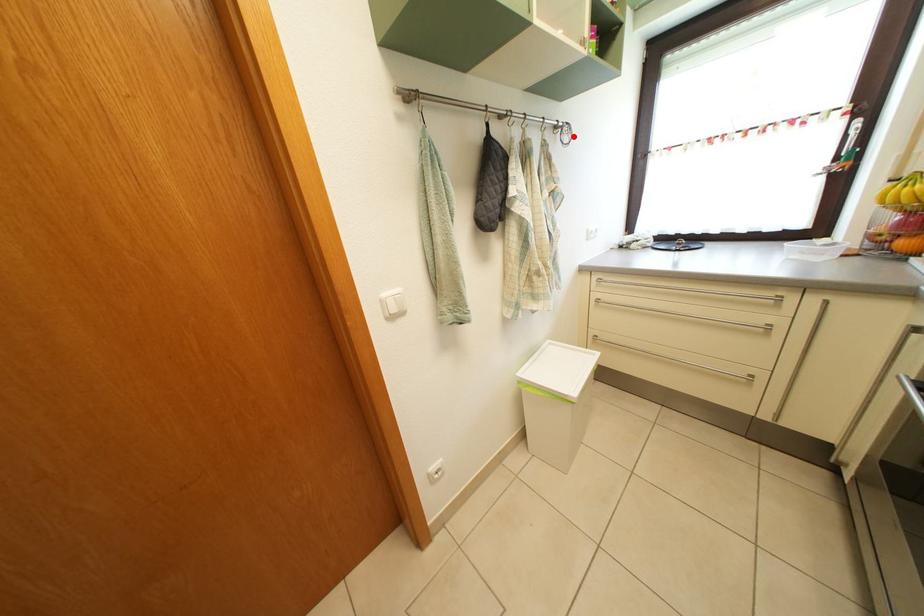
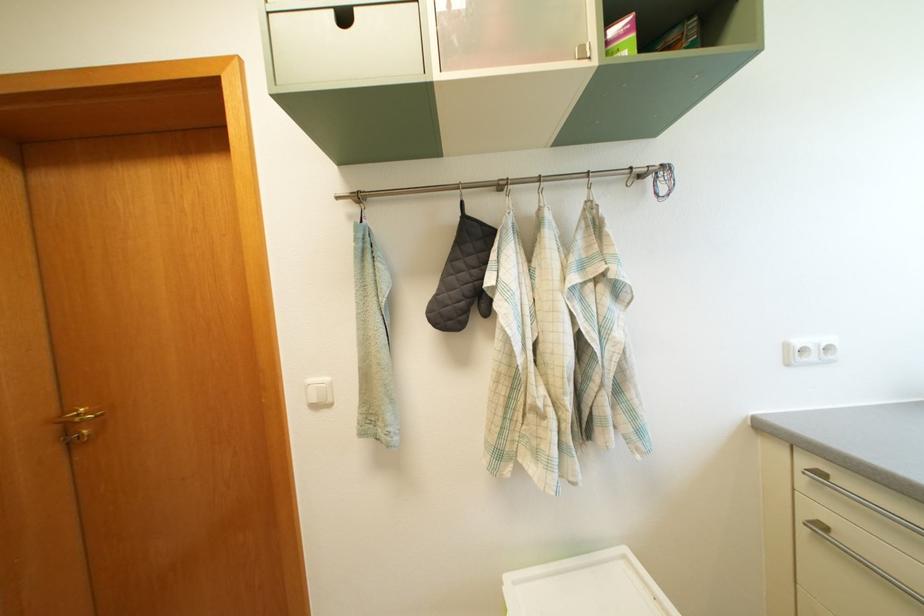
In the second image, find the point that corresponds to the highlighted location in the first image.

(669, 180)